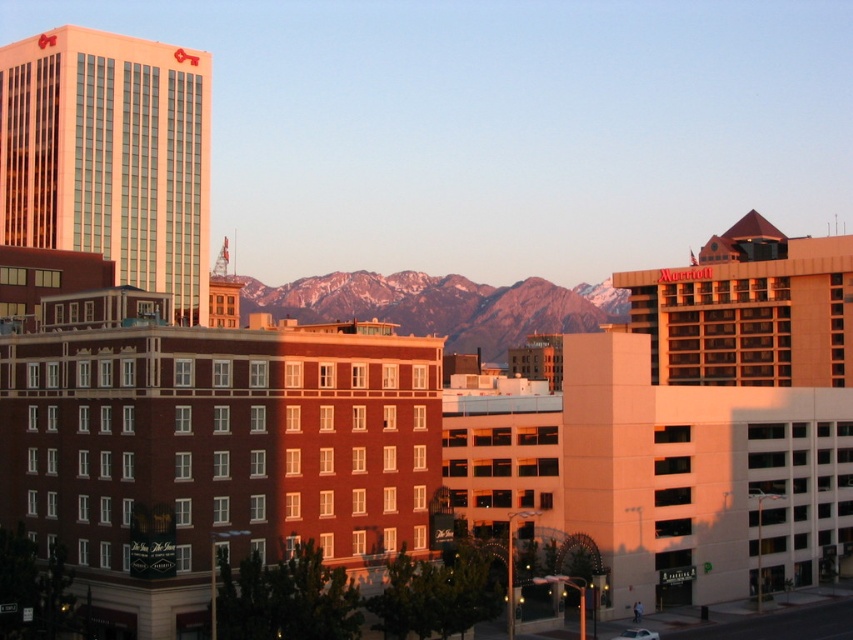
Question: Is brown brick building at center bigger than snowy mountain range at center?

Choices:
 (A) yes
 (B) no

Answer: (B)

Question: Which object is positioned farthest from the matte glass skyscraper at upper left?

Choices:
 (A) brick building at center
 (B) snowy mountain range at center

Answer: (B)

Question: Which point appears farthest from the camera in this image?

Choices:
 (A) (39, 204)
 (B) (167, 428)
 (C) (426, 352)
 (D) (210, 316)

Answer: (D)

Question: Considering the real-world distances, which object is closest to the brick building at center?

Choices:
 (A) snowy mountain range at center
 (B) matte glass skyscraper at upper left
 (C) brown brick building at center

Answer: (C)

Question: Can you confirm if brick building at center is positioned to the right of matte glass skyscraper at upper left?

Choices:
 (A) no
 (B) yes

Answer: (B)

Question: Considering the relative positions of brick building at center and matte glass skyscraper at upper left in the image provided, where is brick building at center located with respect to matte glass skyscraper at upper left?

Choices:
 (A) below
 (B) above

Answer: (A)